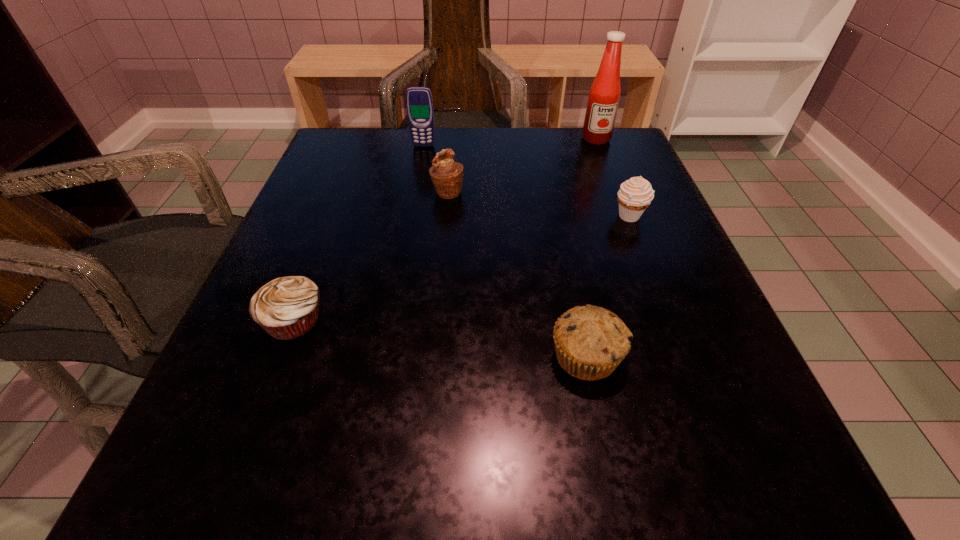
Where is `muffin that is the second closest to the third nearest muffin`? muffin that is the second closest to the third nearest muffin is located at coordinates (447, 176).

You are a GUI agent. You are given a task and a screenshot of the screen. Output one action in this format:
    pyautogui.click(x=<x>, y=<y>)
    Task: Click on the free location that satisfies the following two spatial constraints: 1. on the back side of the leftmost muffin; 2. on the right side of the fourth farthest object
    
    Given the screenshot: What is the action you would take?
    pyautogui.click(x=333, y=217)

Find the location of a particular element. free region that satisfies the following two spatial constraints: 1. on the front-facing side of the cellular telephone; 2. on the left side of the fourth farthest object is located at coordinates (411, 217).

You are a GUI agent. You are given a task and a screenshot of the screen. Output one action in this format:
    pyautogui.click(x=<x>, y=<y>)
    Task: Click on the vacant region that satisfies the following two spatial constraints: 1. on the front-facing side of the cellular telephone; 2. on the left side of the second farthest muffin
    This screenshot has width=960, height=540.
    Given the screenshot: What is the action you would take?
    pyautogui.click(x=411, y=217)

Where is `vacant area in the image that satisfies the following two spatial constraints: 1. on the front-facing side of the fifth shortest object; 2. on the right side of the farthest muffin`? The image size is (960, 540). vacant area in the image that satisfies the following two spatial constraints: 1. on the front-facing side of the fifth shortest object; 2. on the right side of the farthest muffin is located at coordinates (415, 192).